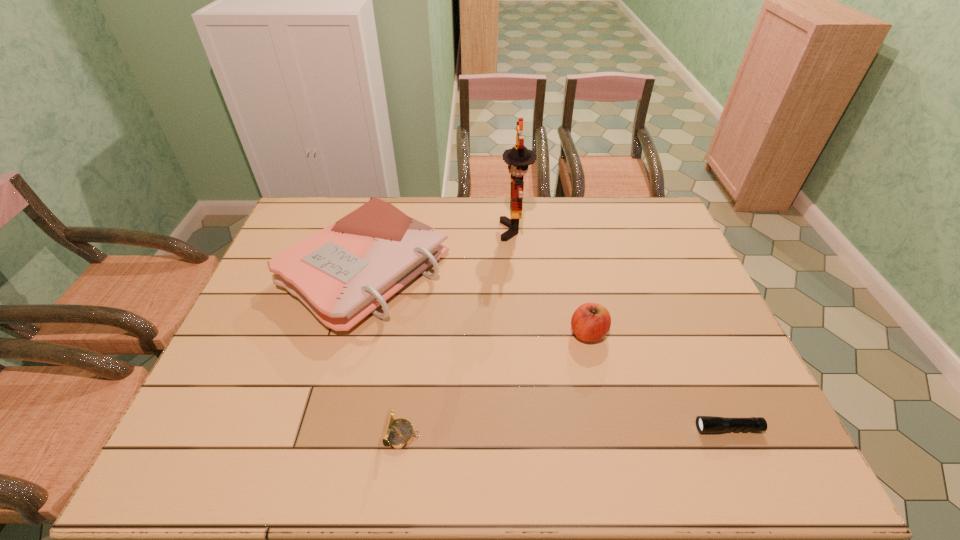
Where is `vacant space that satisfies the following two spatial constraints: 1. on the front-facing side of the tallest object; 2. on the left side of the second object from right to left`? Image resolution: width=960 pixels, height=540 pixels. vacant space that satisfies the following two spatial constraints: 1. on the front-facing side of the tallest object; 2. on the left side of the second object from right to left is located at coordinates (524, 333).